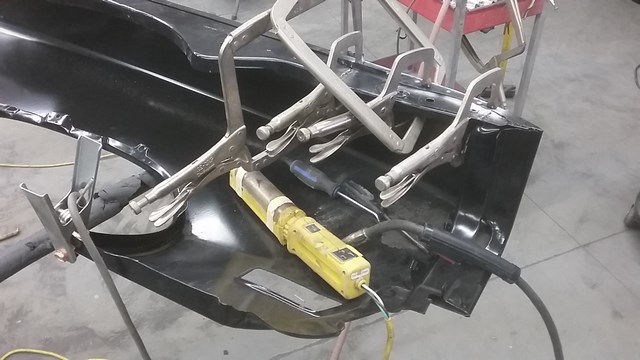
I want to click on yellow extension cord, so click(x=51, y=353).